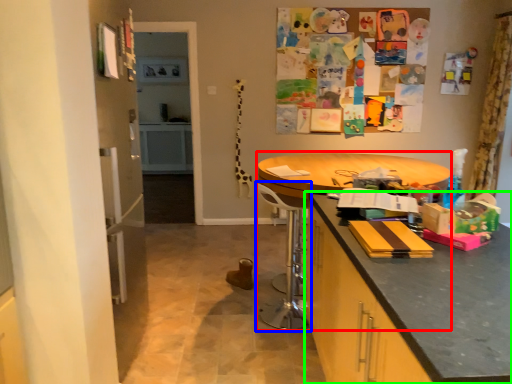
Question: Which is nearer to the round table (highlighted by a red box)? swivel chair (highlighted by a blue box) or cabinetry (highlighted by a green box).

Choices:
 (A) swivel chair
 (B) cabinetry

Answer: (A)